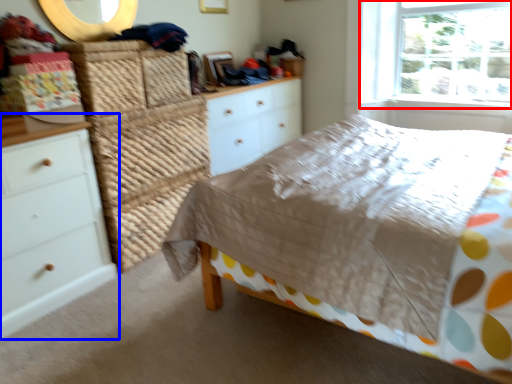
Question: Which point is closer to the camera, window (highlighted by a red box) or chest of drawers (highlighted by a blue box)?

Choices:
 (A) window
 (B) chest of drawers

Answer: (B)